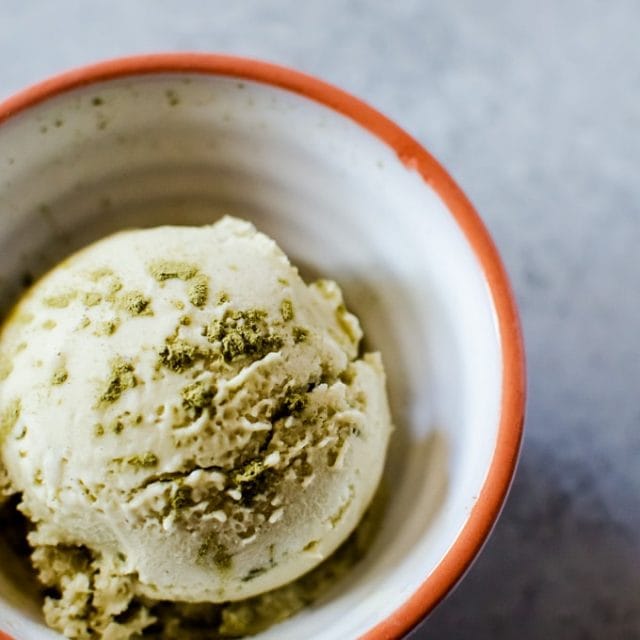
In order to click on bowl in this screenshot , I will do `click(454, 345)`.